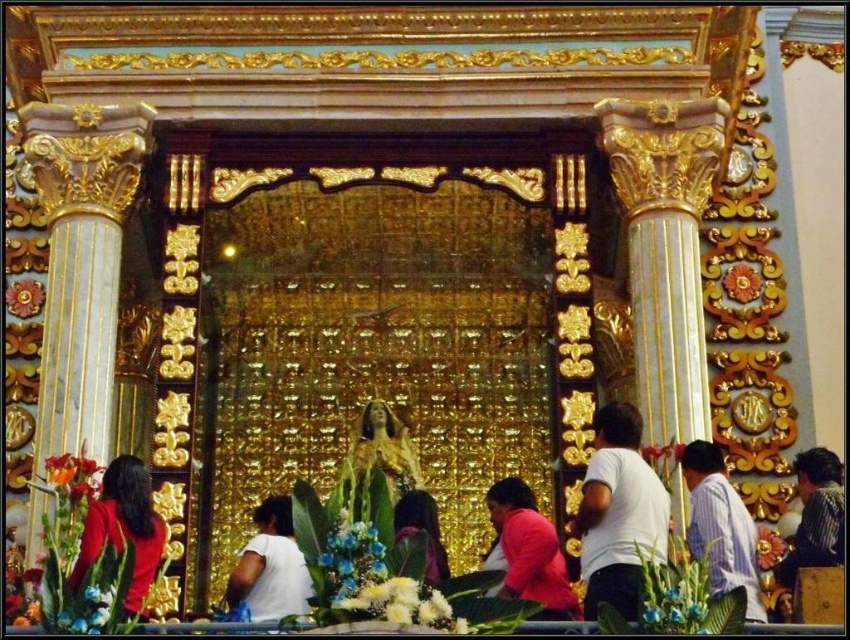
Question: Which point is closer to the camera?

Choices:
 (A) (264, 620)
 (B) (519, 554)
 (C) (814, 536)

Answer: (A)

Question: Does striped shirt at lower right appear on the right side of matte gold flower at upper left?

Choices:
 (A) no
 (B) yes

Answer: (B)

Question: Is gold leaf statue at center positioned before matte gold flower at upper left?

Choices:
 (A) no
 (B) yes

Answer: (B)

Question: Which point appears farthest from the camera in this image?

Choices:
 (A) (69, 576)
 (B) (718, 545)
 (C) (517, 538)

Answer: (C)

Question: Does white matte shirt at lower center have a greater width compared to dark hair at center?

Choices:
 (A) no
 (B) yes

Answer: (B)

Question: Among these objects, which one is farthest from the camera?

Choices:
 (A) matte gold flower at upper left
 (B) shiny gold flower at upper right
 (C) dark hair at center
 (D) striped shirt at lower right

Answer: (A)